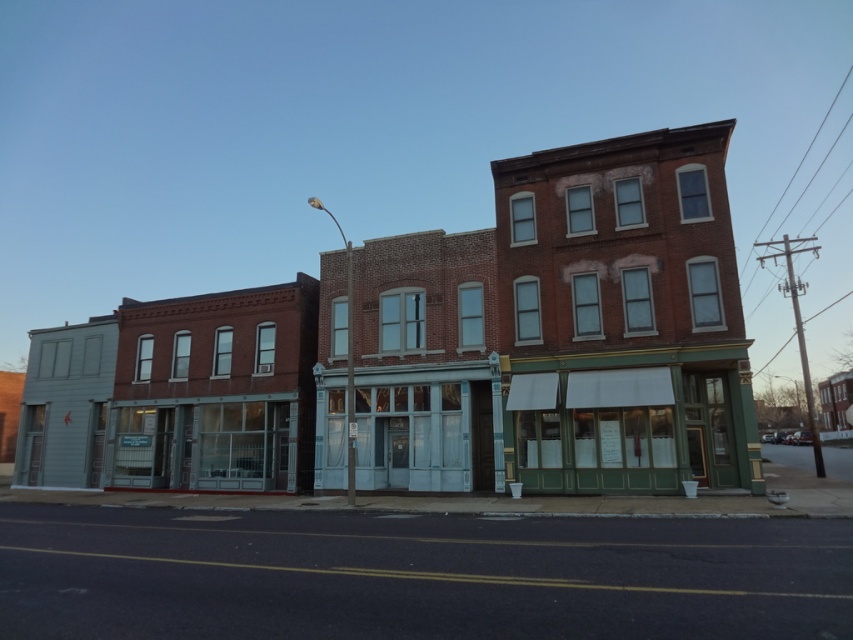
Does white glass storefront at center have a lesser height compared to clear glass storefront at center?

Incorrect, white glass storefront at center's height does not fall short of clear glass storefront at center's.

Is white glass storefront at center bigger than clear glass storefront at center?

Indeed, white glass storefront at center has a larger size compared to clear glass storefront at center.

Between point (329, 371) and point (135, 440), which one is positioned behind?

Positioned behind is point (135, 440).

Identify the location of white glass storefront at center. The width and height of the screenshot is (853, 640). (428, 426).

Measure the distance between green painted wood storefront at center and clear glass storefront at center.

The distance of green painted wood storefront at center from clear glass storefront at center is 17.12 meters.

Is point (564, 426) more distant than point (170, 454)?

That is False.

Where is `green painted wood storefront at center`? The width and height of the screenshot is (853, 640). green painted wood storefront at center is located at coordinates (634, 419).

Is green painted wood storefront at center thinner than white glass storefront at center?

Indeed, green painted wood storefront at center has a lesser width compared to white glass storefront at center.

This screenshot has height=640, width=853. What do you see at coordinates (634, 419) in the screenshot?
I see `green painted wood storefront at center` at bounding box center [634, 419].

The height and width of the screenshot is (640, 853). I want to click on green painted wood storefront at center, so click(634, 419).